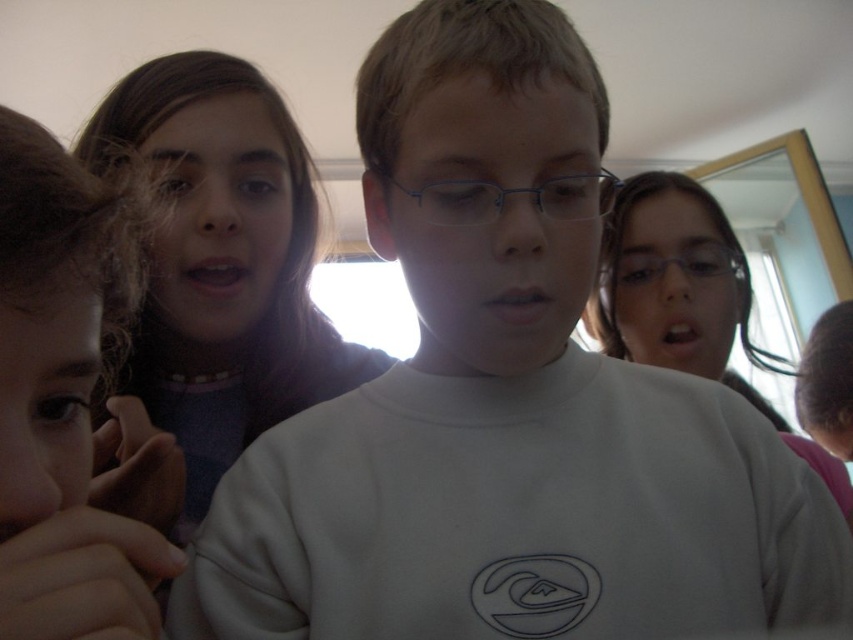
Question: Which object is the farthest from the clear plastic glasses at center?

Choices:
 (A) smooth brown hair at left
 (B) matte white shirt at center
 (C) metallic blue glasses at center

Answer: (A)

Question: Does matte white shirt at center have a smaller size compared to clear plastic glasses at center?

Choices:
 (A) yes
 (B) no

Answer: (B)

Question: From the image, what is the correct spatial relationship of metallic blue glasses at center in relation to clear plastic glasses at center?

Choices:
 (A) above
 (B) below

Answer: (A)

Question: Where is matte white shirt at center located in relation to smooth brown hair at left in the image?

Choices:
 (A) above
 (B) below

Answer: (A)

Question: Which is farther from the clear plastic glasses at center?

Choices:
 (A) metallic blue glasses at center
 (B) matte white shirt at center
 (C) smooth brown hair at left

Answer: (C)

Question: Which of these objects is positioned closest to the matte white shirt at center?

Choices:
 (A) smooth brown hair at left
 (B) metallic blue glasses at center
 (C) clear plastic glasses at center

Answer: (B)